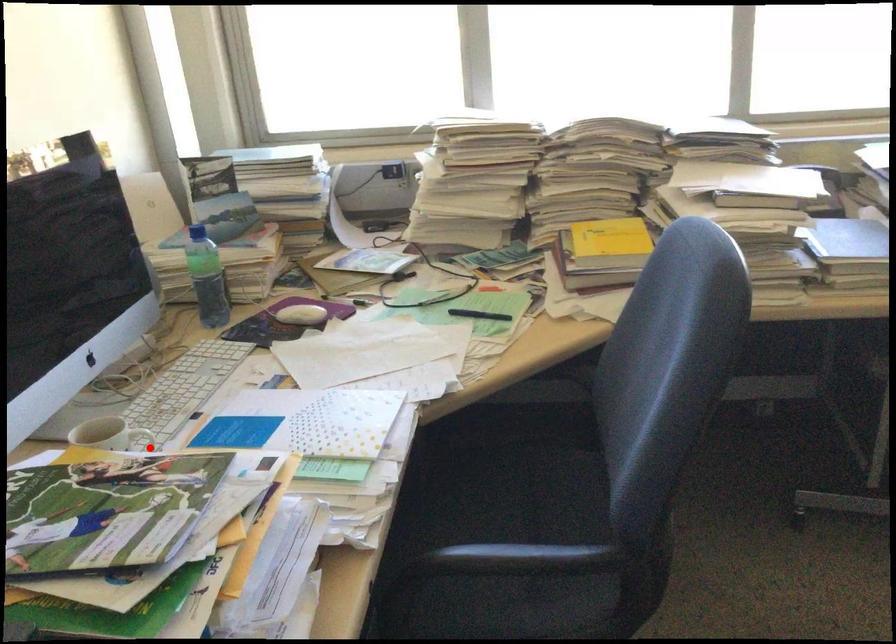
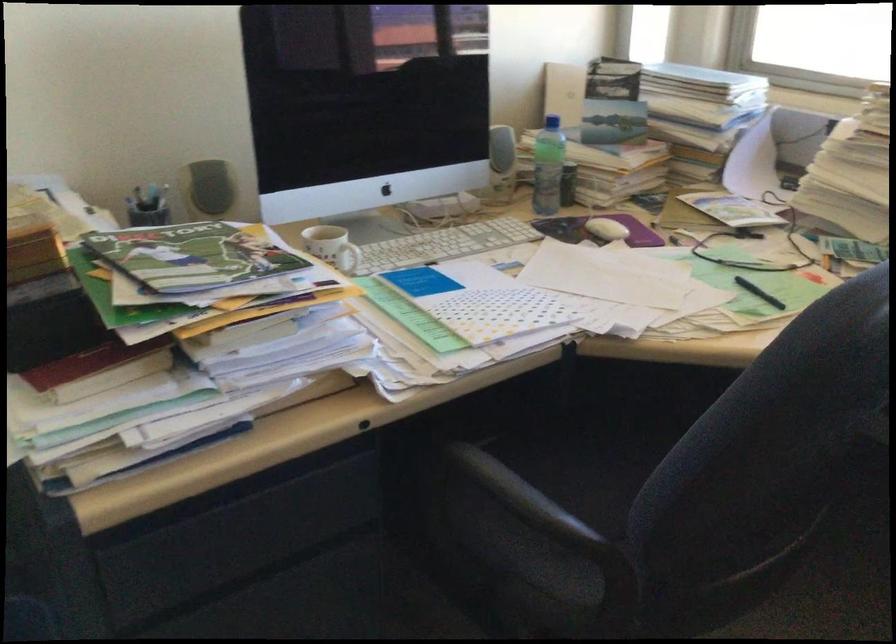
Find the pixel in the second image that matches the highlighted location in the first image.

(348, 258)